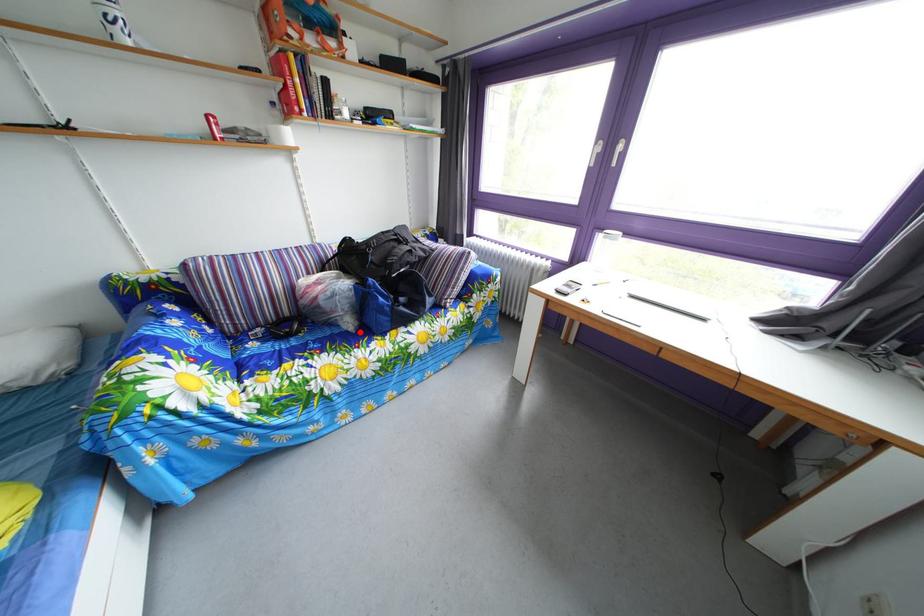
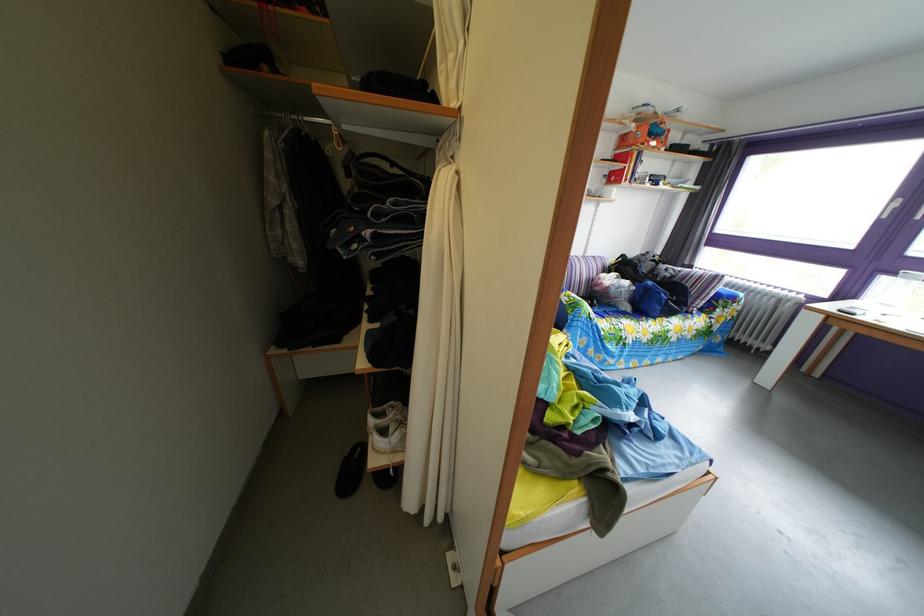
Question: I am providing you with two images of the same scene from different viewpoints. In image1, a red point is highlighted. Considering the same 3D point in image2, which of the following is correct?

Choices:
 (A) It is closer
 (B) It is farther

Answer: (A)